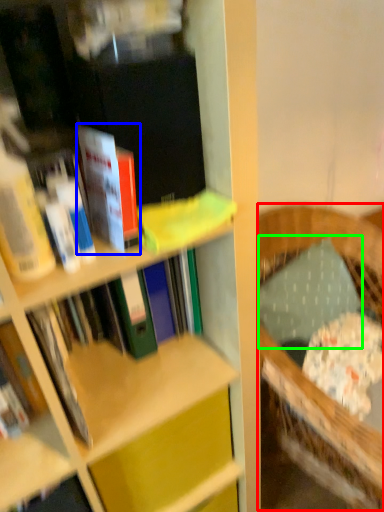
Question: Estimate the real-world distances between objects in this image. Which object is farther from rocking chair (highlighted by a red box), book (highlighted by a blue box) or pillow (highlighted by a green box)?

Choices:
 (A) book
 (B) pillow

Answer: (A)